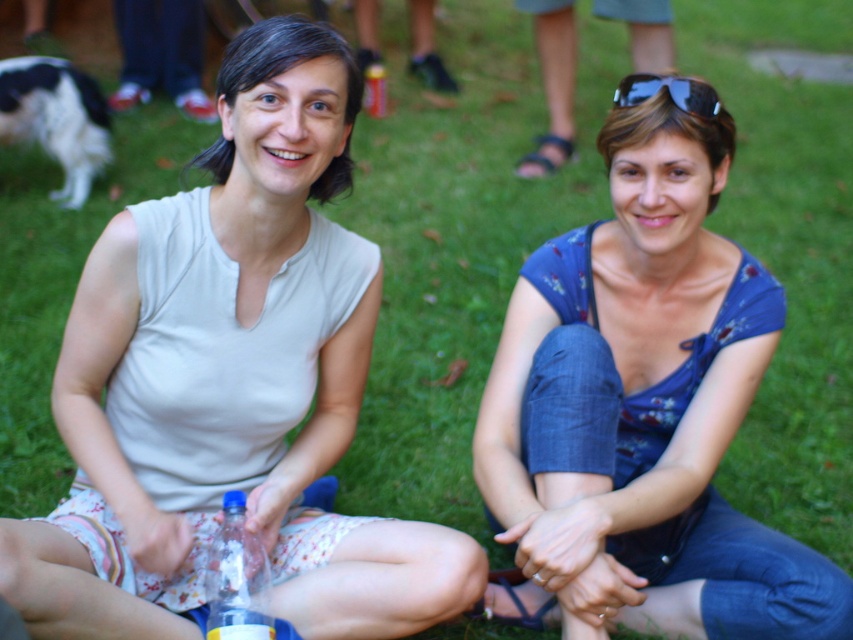
What do you see at coordinates (236, 579) in the screenshot? I see `translucent plastic bottle at center` at bounding box center [236, 579].

Is translucent plastic bottle at center positioned before black reflective sunglasses at upper right?

Yes.

You are a GUI agent. You are given a task and a screenshot of the screen. Output one action in this format:
    pyautogui.click(x=<x>, y=<y>)
    Task: Click on the translucent plastic bottle at center
    The width and height of the screenshot is (853, 640).
    Given the screenshot: What is the action you would take?
    pyautogui.click(x=236, y=579)

This screenshot has height=640, width=853. Find the location of `translucent plastic bottle at center`. translucent plastic bottle at center is located at coordinates (236, 579).

Can you confirm if blue floral dress at center is bigger than translucent plastic bottle at center?

Yes.

Does blue floral dress at center come in front of translucent plastic bottle at center?

No.

Locate an element on the screen. blue floral dress at center is located at coordinates (642, 412).

Is blue floral dress at center bigger than black reflective sunglasses at upper right?

Correct, blue floral dress at center is larger in size than black reflective sunglasses at upper right.

In the scene shown: Is blue floral dress at center further to the viewer compared to black reflective sunglasses at upper right?

No, it is not.

Is point (688, 333) farther from camera compared to point (677, 80)?

Yes, point (688, 333) is farther from viewer.

Identify the location of blue floral dress at center. (642, 412).